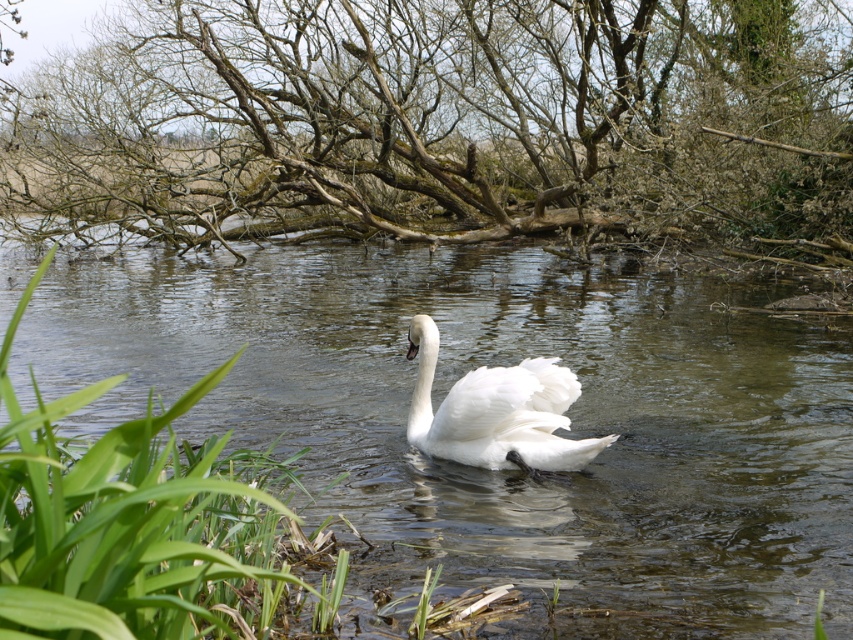
You are standing at the edge of the water and want to reach the clear water at center marked by point (502, 364). The swan is swimming towards the right side. Should you walk to the left or right of the swan to avoid disturbing it?

You should walk to the left of the swan to avoid disturbing it since the swan is moving towards the right side, and the clear water at center is located at point (502, 364).

From the picture: You are standing at the edge of the water and want to locate the clear water at center. According to the coordinates provided, in which direction should you look relative to your position?

The clear water at center is located at coordinates point (502, 364), so you should look towards the center of the image where the swan is swimming.

You are a photographer trying to capture the white feathered swan at center in your shot. You notice the clear water at center is also in the frame. Which object is positioned more to the left in the image?

The clear water at center is positioned more to the left than the white feathered swan at center according to the description.